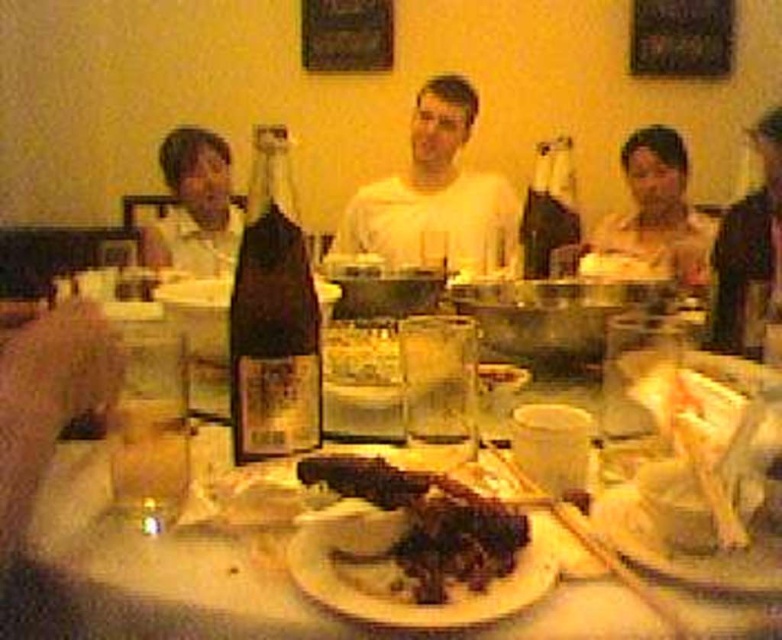
Measure the distance between point (171,179) and camera.

A distance of 3.00 meters exists between point (171,179) and camera.

Is matte black shirt at left positioned behind translucent glass at table center?

That is True.

Who is more forward, (221,243) or (122,444)?

Positioned in front is point (122,444).

Locate an element on the screen. matte black shirt at left is located at coordinates (196, 205).

Between matte black shirt at left and dark glass bottle at center, which one has more height?

matte black shirt at left

Consider the image. Can you confirm if matte black shirt at left is bigger than dark glass bottle at center?

Yes.

Who is more distant from viewer, (158, 234) or (533, 218)?

Point (158, 234)

Locate an element on the screen. This screenshot has width=782, height=640. matte black shirt at left is located at coordinates (196, 205).

Does brown crispy meat at center appear on the right side of translucent glass at table center?

Correct, you'll find brown crispy meat at center to the right of translucent glass at table center.

Does brown crispy meat at center have a lesser height compared to translucent glass at table center?

Yes.

Between point (305, 477) and point (174, 456), which one is positioned in front?

Point (305, 477)

Find the location of a particular element. brown crispy meat at center is located at coordinates (425, 524).